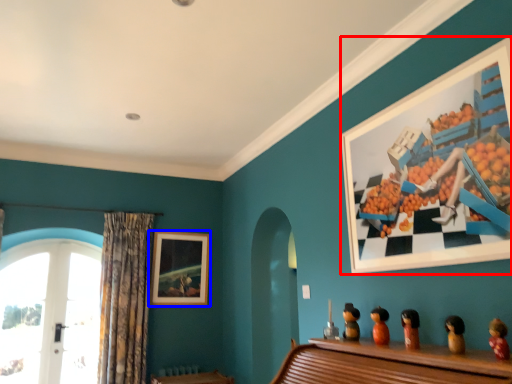
Question: Which object is closer to the camera taking this photo, picture frame (highlighted by a red box) or picture frame (highlighted by a blue box)?

Choices:
 (A) picture frame
 (B) picture frame

Answer: (A)